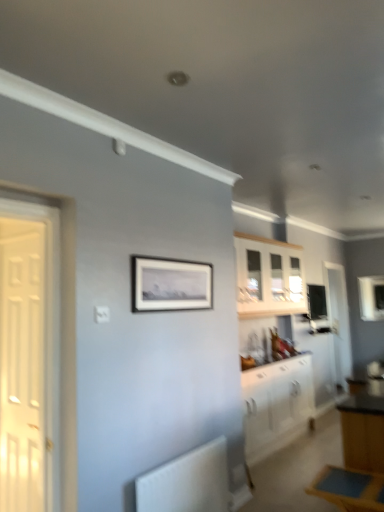
Question: Is white wooden door at left, the first door positioned from the left, to the left or to the right of blue wooden table at lower right in the image?

Choices:
 (A) right
 (B) left

Answer: (B)

Question: From a real-world perspective, relative to blue wooden table at lower right, is white wooden door at left, which is the second door from right to left, vertically above or below?

Choices:
 (A) above
 (B) below

Answer: (A)

Question: Which of these objects is positioned closest to the blue wooden table at lower right?

Choices:
 (A) white glossy door at right, which is the 1th door from right to left
 (B) white wood cabinet at upper center, which appears as the 1th cabinetry when viewed from the top
 (C) clear glass window at upper right
 (D) white glossy cabinet at lower right, the 1th cabinetry from the bottom
 (E) matte black picture frame at center

Answer: (E)

Question: Considering the real-world distances, which object is closest to the clear glass window at upper right?

Choices:
 (A) white wood cabinet at upper center, which appears as the 1th cabinetry when viewed from the top
 (B) white wooden door at left, arranged as the 2th door when viewed from the back
 (C) matte black picture frame at center
 (D) white matte radiator at lower left
 (E) white glossy cabinet at lower right, the 1th cabinetry from the bottom

Answer: (A)